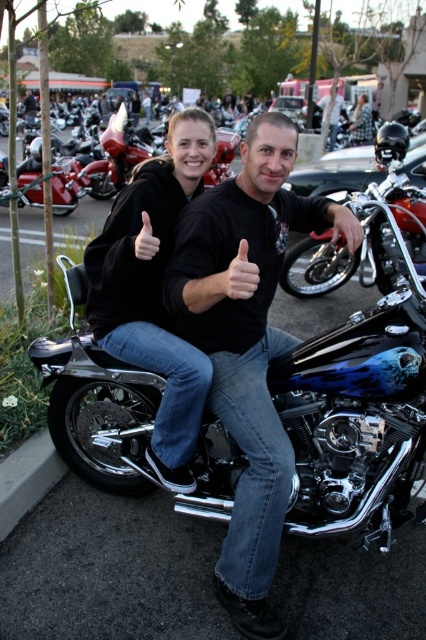
Question: Which object appears farthest from the camera in this image?

Choices:
 (A) black matte shirt at center
 (B) black matte motorcycle at center
 (C) denim jacket at center

Answer: (C)

Question: Which of the following is the farthest from the observer?

Choices:
 (A) (152, 216)
 (B) (337, 122)
 (C) (368, 109)

Answer: (C)

Question: From the image, what is the correct spatial relationship of black matte shirt at center in relation to denim jacket at center?

Choices:
 (A) above
 (B) below

Answer: (B)

Question: Which point is farther to the camera?

Choices:
 (A) black matte motorcycle at center
 (B) black matte shirt at center
 (C) gray concrete curb at lower left
 (D) denim jacket at center

Answer: (D)

Question: Is black matte shirt at center below gray concrete curb at lower left?

Choices:
 (A) yes
 (B) no

Answer: (B)

Question: Is black matte jacket at center wider than gray concrete curb at lower left?

Choices:
 (A) yes
 (B) no

Answer: (A)